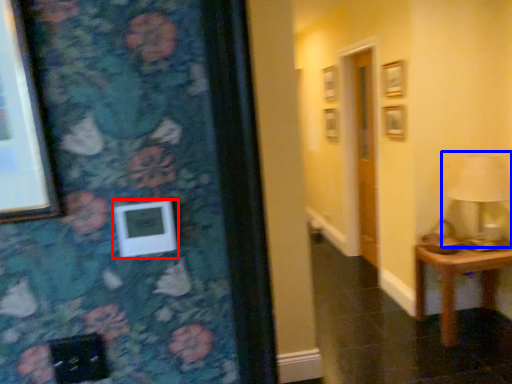
Question: Which point is closer to the camera, picture frame (highlighted by a red box) or table lamp (highlighted by a blue box)?

Choices:
 (A) picture frame
 (B) table lamp

Answer: (A)